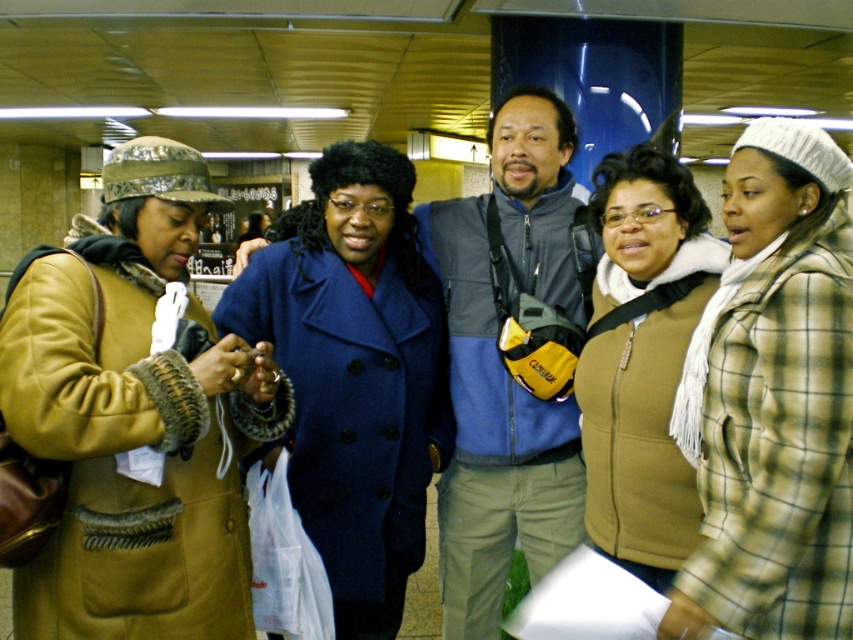
You are a delivery robot with a 1.5 meter arm reach. You need to hand a package to the person wearing the matte blue coat at center. Can your arm reach them?

The matte blue coat at center is 1.83 meters away from the viewer, so the robot cannot reach them with a 1.5 meter arm.

Looking at this image, you are a photographer trying to capture a candid shot of the matte blue coat at center and the blue fleece vest at center. Since you want to ensure both are visible in the frame, which one should you focus on first to avoid blurring due to their positions?

The matte blue coat at center is positioned under the blue fleece vest at center, so you should focus on the blue fleece vest at center first as it is closer to the camera. This ensures the foreground subject is sharp, and the background subject will naturally be in focus as well.

Based on the photo, you are a photographer trying to capture a candid shot of the blue fleece vest at center without including the matte blue coat at center in the frame. Based on their positions, is this possible?

The matte blue coat at center is closer to the viewer than the blue fleece vest at center, so it would block the view of the blue fleece vest at center. Therefore, capturing the blue fleece vest at center without the matte blue coat at center in the frame is not possible.